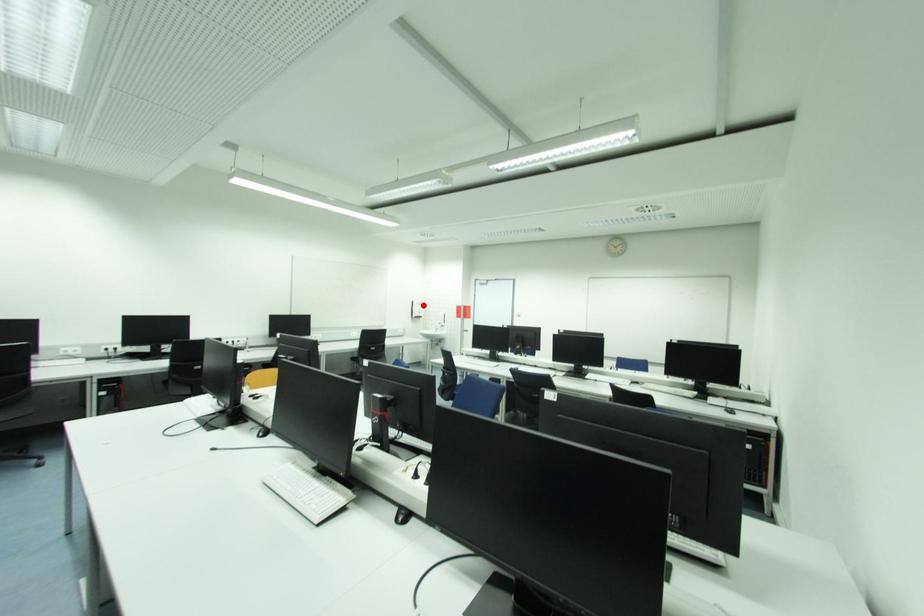
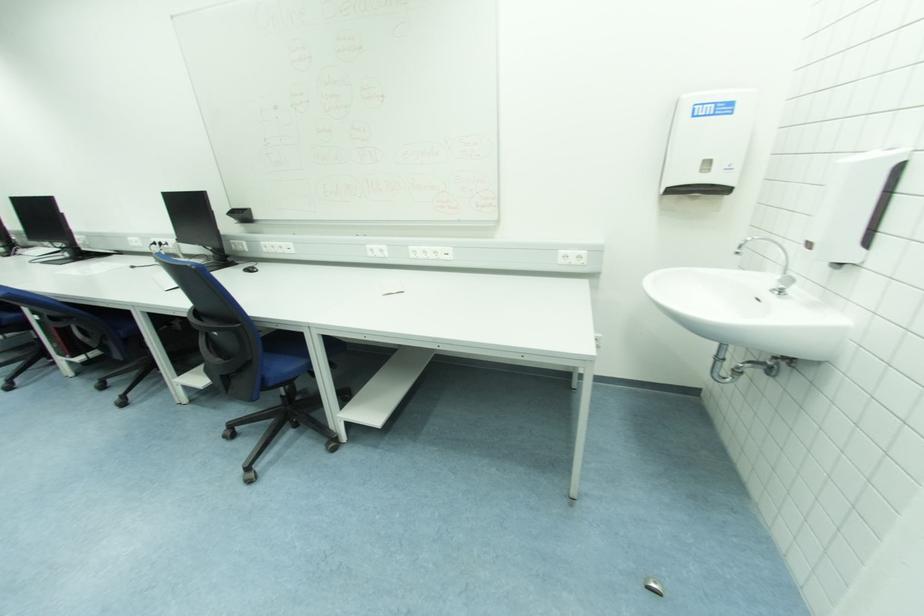
Find the pixel in the second image that matches the highlighted location in the first image.

(731, 110)